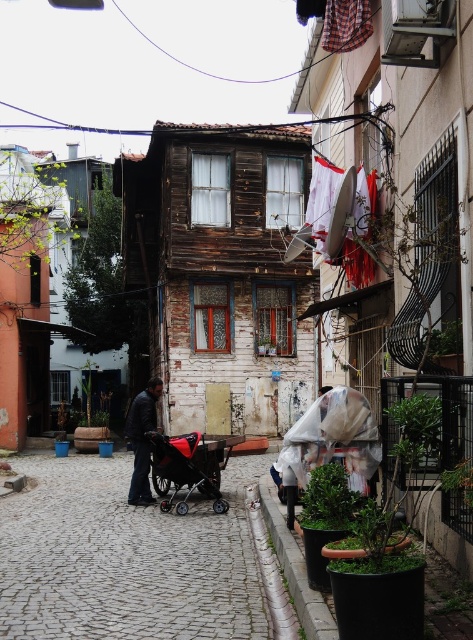
Describe the element at coordinates (123, 557) in the screenshot. This screenshot has width=473, height=640. I see `red fabric stroller at center` at that location.

Between red fabric stroller at center and red matte baby carriage at center, which one has less height?

With less height is red fabric stroller at center.

The image size is (473, 640). What do you see at coordinates (123, 557) in the screenshot?
I see `red fabric stroller at center` at bounding box center [123, 557].

You are a GUI agent. You are given a task and a screenshot of the screen. Output one action in this format:
    pyautogui.click(x=<x>, y=<y>)
    Task: Click on the red fabric stroller at center
    The width and height of the screenshot is (473, 640).
    Given the screenshot: What is the action you would take?
    pyautogui.click(x=123, y=557)

Is red matte baby carriage at center above dark gray fabric jacket at center?

No.

Does red matte baby carriage at center appear on the right side of dark gray fabric jacket at center?

Correct, you'll find red matte baby carriage at center to the right of dark gray fabric jacket at center.

Is point (152, 442) closer to camera compared to point (147, 385)?

Yes, it is.

Identify the location of red matte baby carriage at center. (185, 468).

Between red fabric stroller at center and dark gray fabric jacket at center, which one appears on the left side from the viewer's perspective?

dark gray fabric jacket at center

This screenshot has height=640, width=473. Identify the location of red fabric stroller at center. (123, 557).

Locate an element on the screen. The image size is (473, 640). red fabric stroller at center is located at coordinates (123, 557).